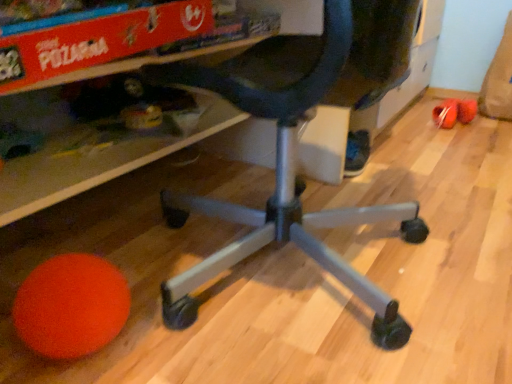
Locate an element on the screen. This screenshot has height=384, width=512. vacant space behind rubberized plastic ball at lower left is located at coordinates (419, 115).